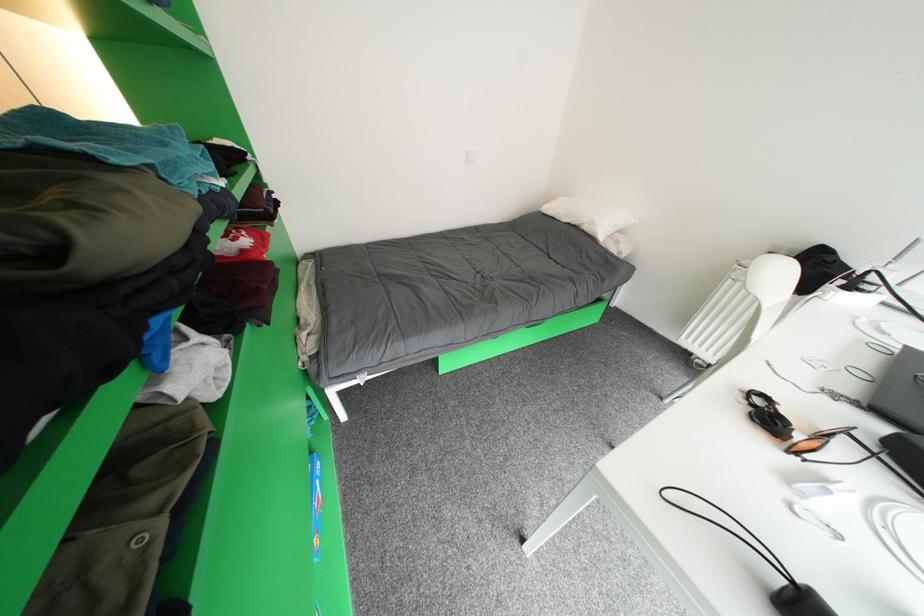
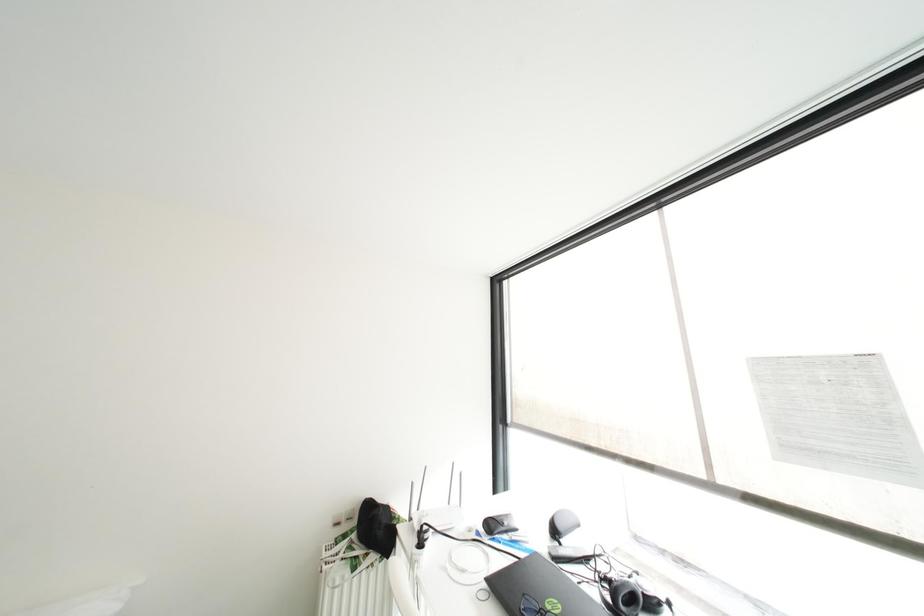
Question: The images are taken continuously from a first-person perspective. In which direction is your viewpoint rotating?

Choices:
 (A) Left
 (B) Right
 (C) Up
 (D) Down

Answer: (B)